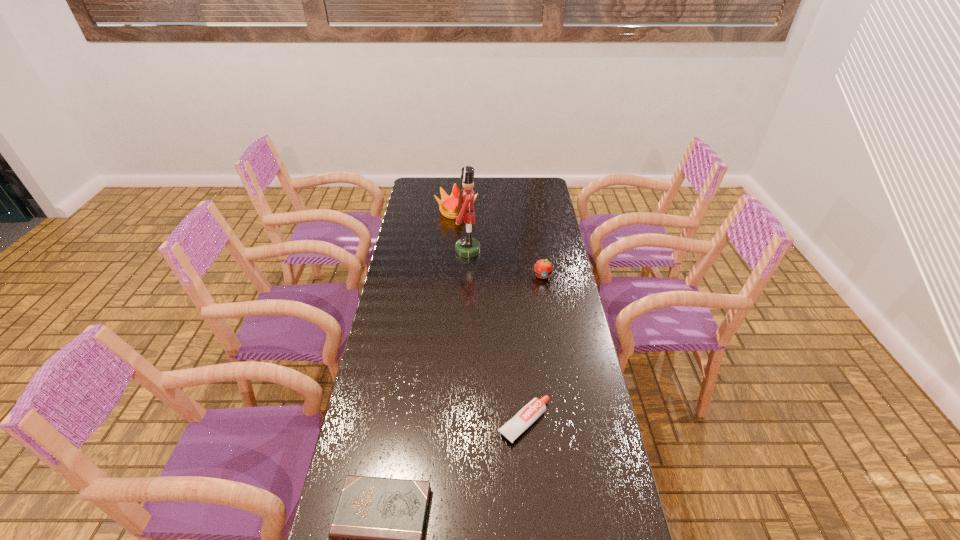
Where is `nutcracker`? The image size is (960, 540). nutcracker is located at coordinates [467, 247].

Where is `the tallest object`? This screenshot has height=540, width=960. the tallest object is located at coordinates (467, 247).

Where is `the farthest object`? Image resolution: width=960 pixels, height=540 pixels. the farthest object is located at coordinates (448, 205).

In order to click on the fourth shortest object in this screenshot , I will do tap(448, 205).

What are the coordinates of `the third farthest object` in the screenshot? It's located at (543, 268).

Locate an element on the screen. This screenshot has height=540, width=960. the third shortest object is located at coordinates (543, 268).

Locate an element on the screen. This screenshot has width=960, height=540. the fourth tallest object is located at coordinates (534, 409).

Locate an element on the screen. The image size is (960, 540). the fourth farthest object is located at coordinates click(534, 409).

Identify the location of blank space located on the front-facing side of the fourth nearest object. (504, 251).

Locate an element on the screen. The image size is (960, 540). free region located on the front of the crown is located at coordinates (455, 239).